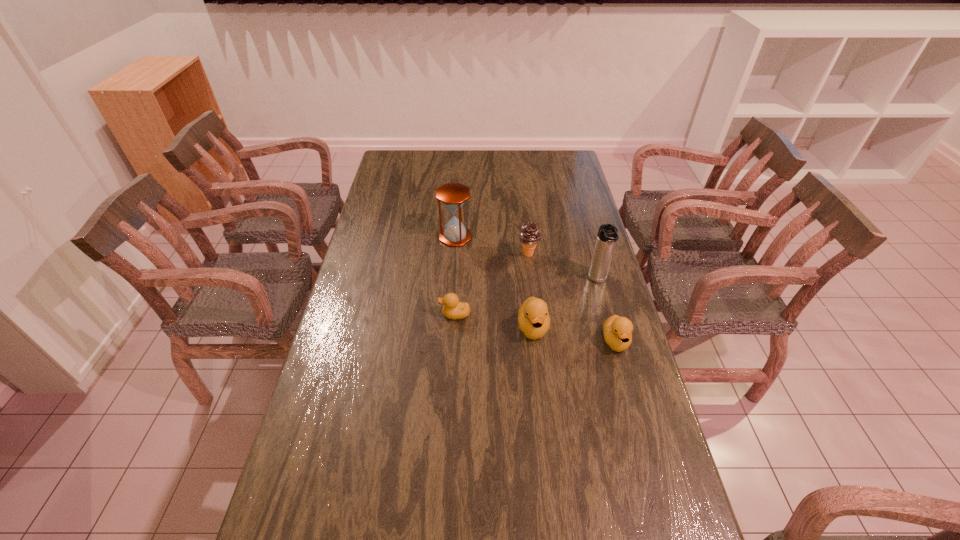
With all ducklings evenly spaced, where should an extra duckling be placed on the left to continue the pattern? Please point out a vacant space. Please provide its 2D coordinates. Your answer should be formatted as a tuple, i.e. [(x, y)], where the tuple contains the x and y coordinates of a point satisfying the conditions above.

[(381, 302)]